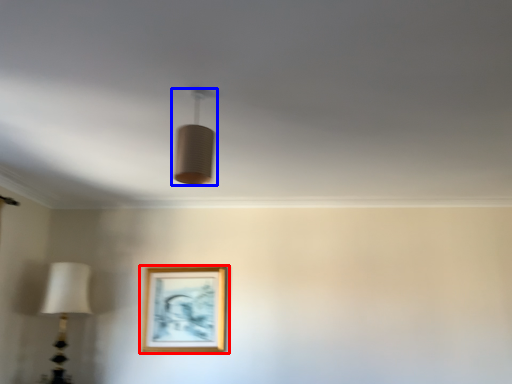
Question: Among these objects, which one is farthest to the camera, picture frame (highlighted by a red box) or lamp (highlighted by a blue box)?

Choices:
 (A) picture frame
 (B) lamp

Answer: (A)